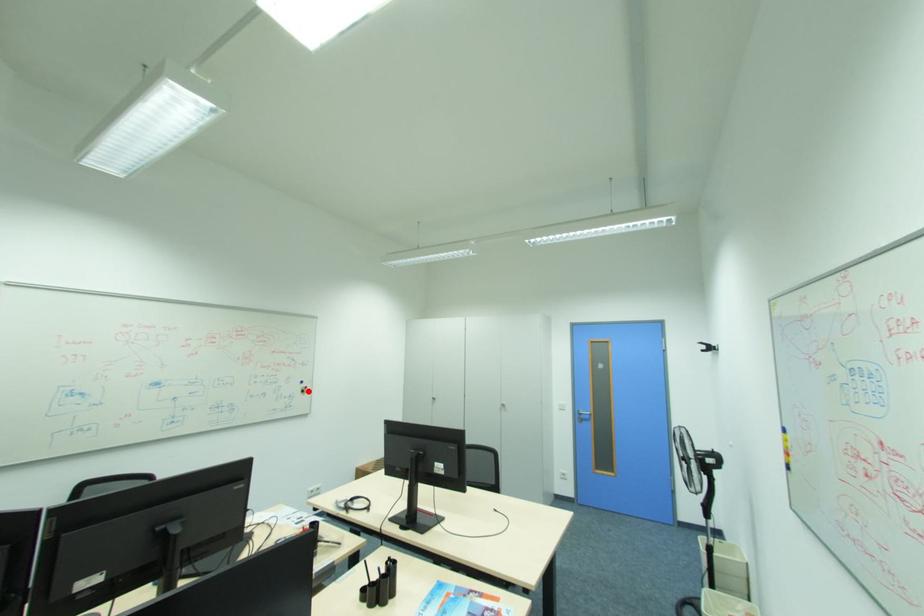
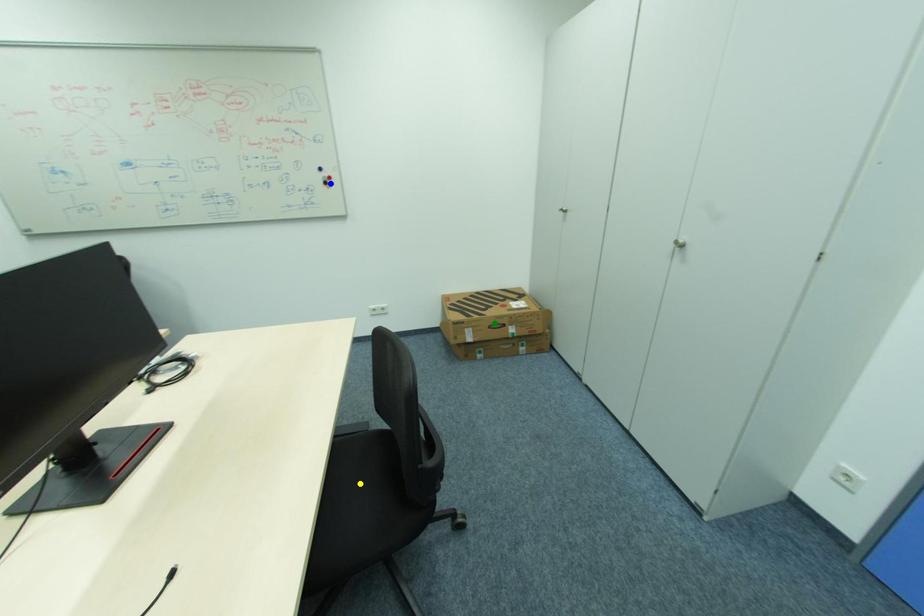
Question: I am providing you with two images of the same scene from different viewpoints. A red point is marked on the first image. You are given multiple points on the second image. Can you choose the point in image 2 that corresponds to the point in image 1?

Choices:
 (A) yellow point
 (B) blue point
 (C) green point

Answer: (B)